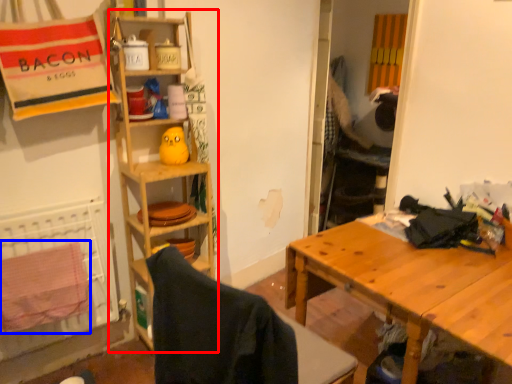
Question: Which of the following is the closest to the observer, shelf (highlighted by a red box) or beach towel (highlighted by a blue box)?

Choices:
 (A) shelf
 (B) beach towel

Answer: (B)